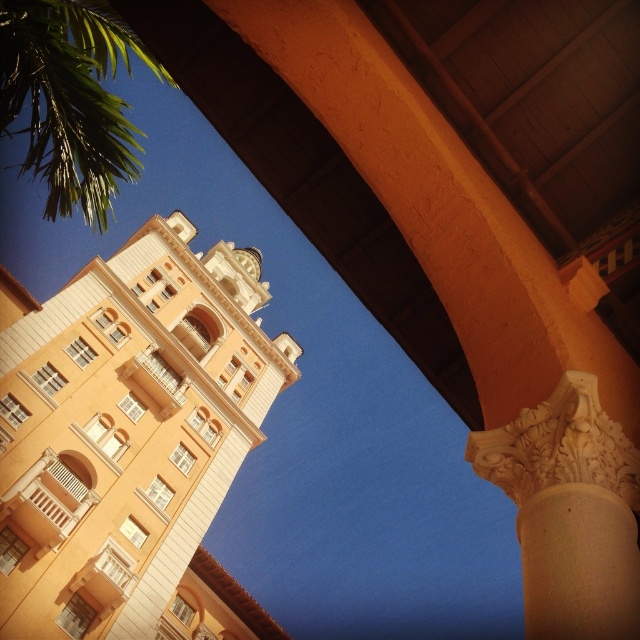
You are standing at the base of the building and looking up. Which object is positioned higher up between the matte orange bell tower at upper center and the white carved stone column at center?

The white carved stone column at center is positioned higher up because the matte orange bell tower at upper center is below it.

You are an architect analyzing the proportions of the building. Which object between the matte orange bell tower at upper center and the green leafy palm tree at upper left has a smaller width?

The matte orange bell tower at upper center is thinner than the green leafy palm tree at upper left, so the matte orange bell tower at upper center has a smaller width.

You are standing under the curved orange beam in the foreground and looking up at the building. Which object, the white carved stone column at center or the green leafy palm tree at upper left, is taller?

The white carved stone column at center is shorter than the green leafy palm tree at upper left, so the green leafy palm tree at upper left is taller.